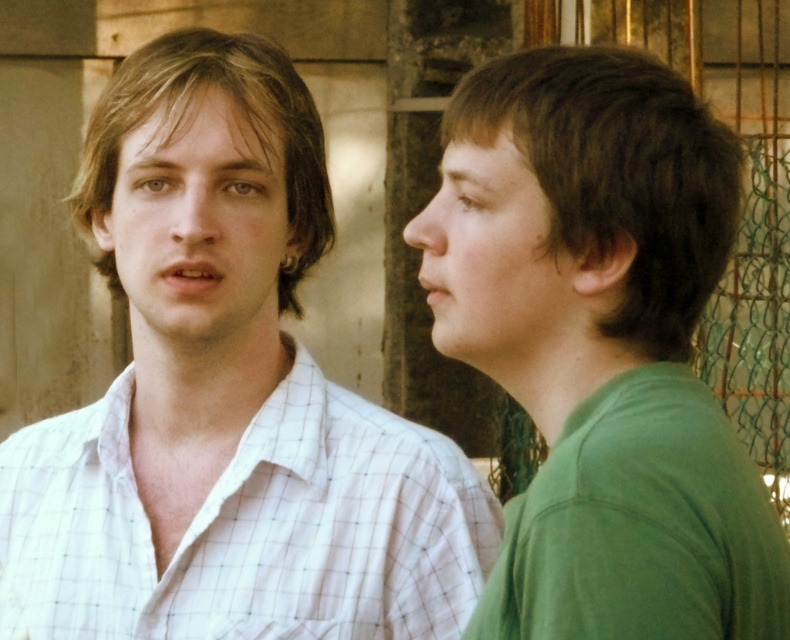
Question: Can you confirm if green matte shirt at right is positioned below white checkered shirt at left?

Choices:
 (A) yes
 (B) no

Answer: (B)

Question: Can you confirm if green matte shirt at right is positioned to the left of white checkered shirt at left?

Choices:
 (A) no
 (B) yes

Answer: (A)

Question: Can you confirm if green matte shirt at right is positioned above white checkered shirt at left?

Choices:
 (A) no
 (B) yes

Answer: (B)

Question: Among these objects, which one is nearest to the camera?

Choices:
 (A) green matte shirt at right
 (B) white checkered shirt at left

Answer: (A)